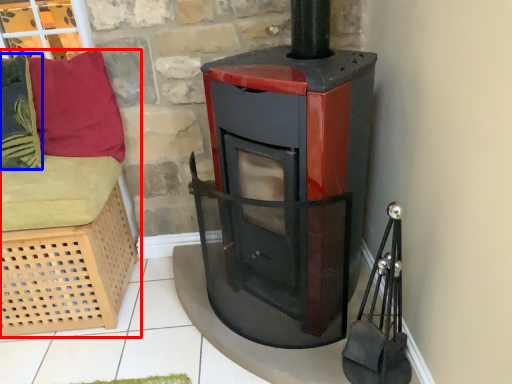
Question: Which object appears farthest to the camera in this image, furniture (highlighted by a red box) or pillow (highlighted by a blue box)?

Choices:
 (A) furniture
 (B) pillow

Answer: (B)